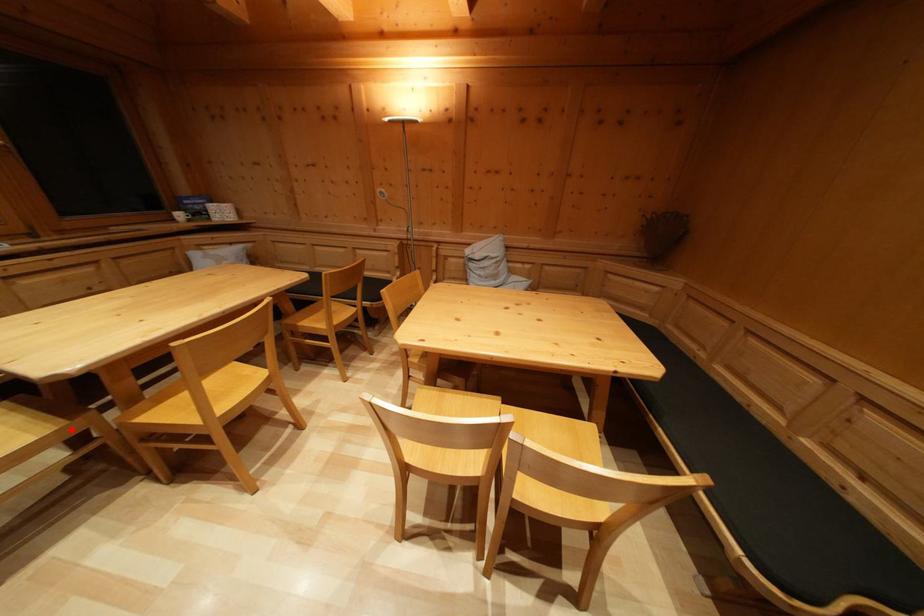
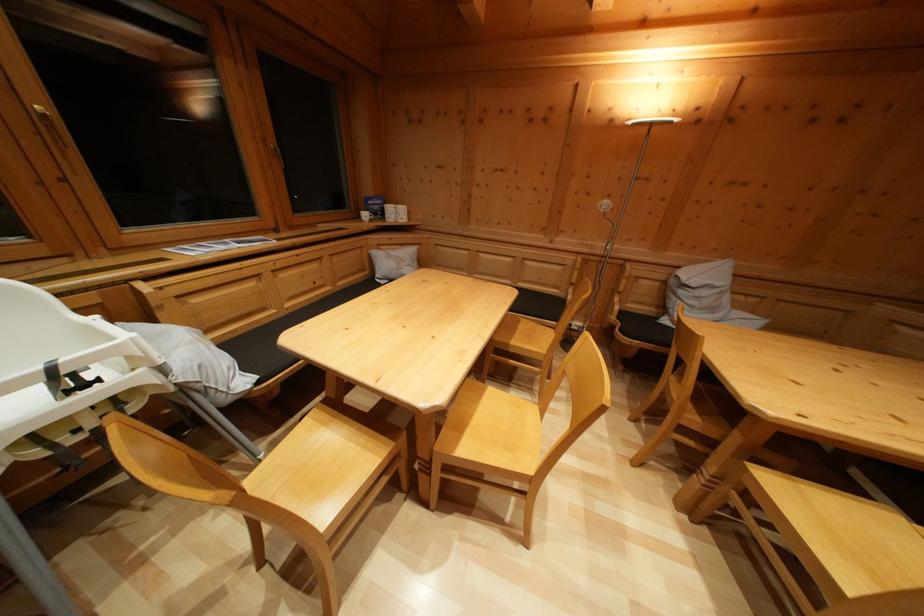
The point at the highlighted location is marked in the first image. Where is the corresponding point in the second image?

(398, 451)